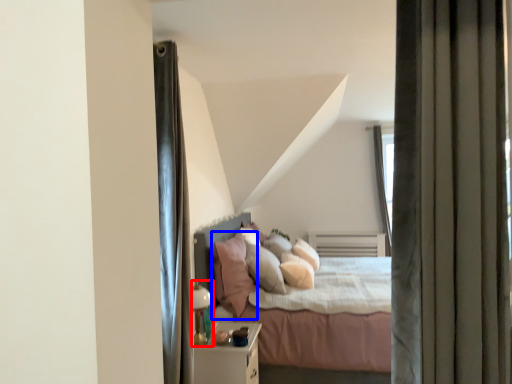
Question: Which object appears closest to the camera in this image, lamp (highlighted by a red box) or pillow (highlighted by a blue box)?

Choices:
 (A) lamp
 (B) pillow

Answer: (A)